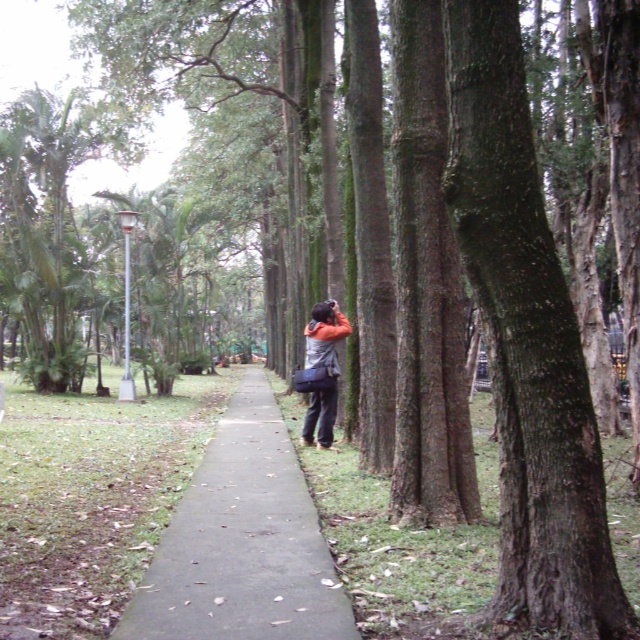
You are standing at the point marked as point (x=243, y=541) in the park scene. What type of surface are you currently standing on?

The surface at point (x=243, y=541) is a gray concrete sidewalk at center.

You are a delivery drone that needs to fly over the gray concrete sidewalk at center and the orange fabric jacket at center. Which object do you need to fly higher above to avoid hitting it?

The orange fabric jacket at center is taller than the gray concrete sidewalk at center, so you need to fly higher above the orange fabric jacket at center to avoid hitting it.

You are a pedestrian walking along the gray concrete sidewalk at center. You see the orange fabric jacket at center ahead of you. Is the jacket closer to you or further away?

The gray concrete sidewalk at center is closer to the viewer than orange fabric jacket at center, so the jacket is further away from you.